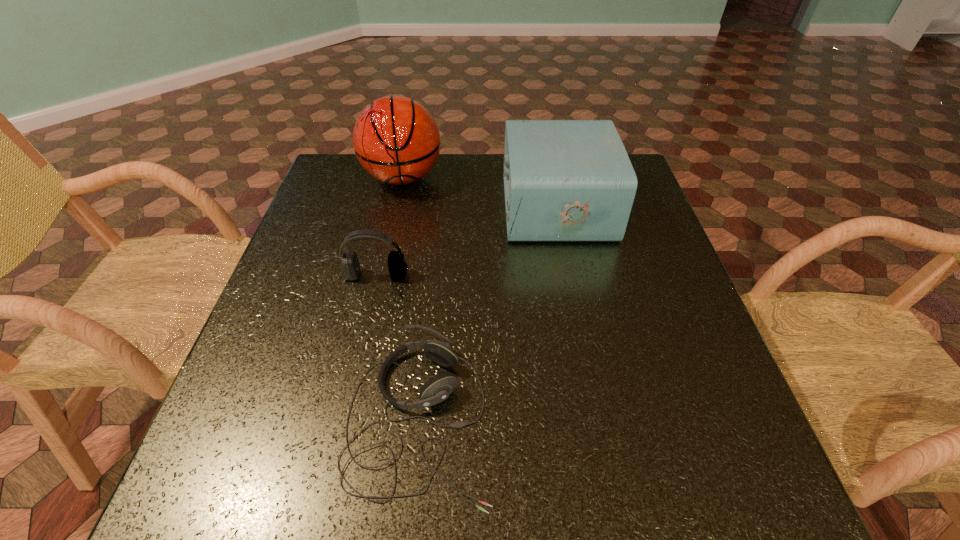
Identify the location of the tallest object. The image size is (960, 540). (396, 139).

I want to click on radio receiver, so click(x=564, y=180).

Identify the location of the third shortest object. (564, 180).

Locate an element on the screen. This screenshot has height=540, width=960. the taller headset is located at coordinates (350, 268).

Identify the location of the farther headset. (350, 268).

This screenshot has width=960, height=540. In order to click on the shorter headset in this screenshot , I will do `click(438, 388)`.

Where is `the nearer headset`? This screenshot has height=540, width=960. the nearer headset is located at coordinates (438, 388).

I want to click on blank space located 0.240m on the side with spill of the tallest object, so (x=384, y=264).

Where is `free space located 0.240m on the front panel of the rightmost object`? free space located 0.240m on the front panel of the rightmost object is located at coordinates (414, 207).

Locate an element on the screen. This screenshot has width=960, height=540. free space located on the front panel of the rightmost object is located at coordinates (459, 207).